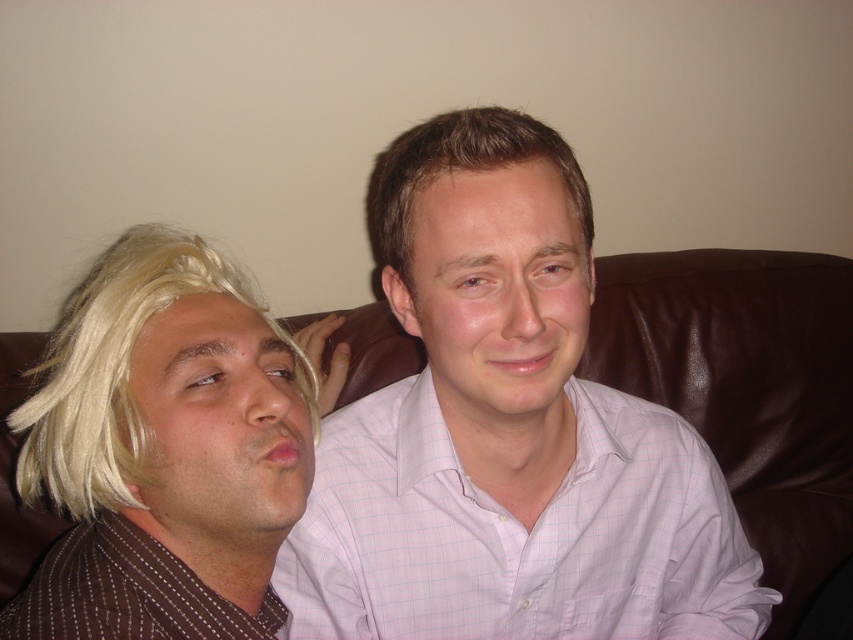
Question: Which point is farther from the camera taking this photo?

Choices:
 (A) (368, 188)
 (B) (480, 614)
 (C) (608, 257)
 (D) (280, 328)

Answer: (C)

Question: From the image, what is the correct spatial relationship of brown leather couch at center in relation to blonde synthetic wig at left?

Choices:
 (A) below
 (B) above

Answer: (A)

Question: Which object appears closest to the camera in this image?

Choices:
 (A) brown leather couch at center
 (B) blonde synthetic wig at left
 (C) pink checkered shirt at center

Answer: (B)

Question: Is brown leather couch at center wider than blonde synthetic wig at left?

Choices:
 (A) no
 (B) yes

Answer: (A)

Question: Which of these objects is positioned closest to the blonde synthetic wig at left?

Choices:
 (A) brown smooth hair at center
 (B) pink checkered shirt at center

Answer: (B)

Question: Is brown leather couch at center wider than blonde synthetic wig at left?

Choices:
 (A) yes
 (B) no

Answer: (B)